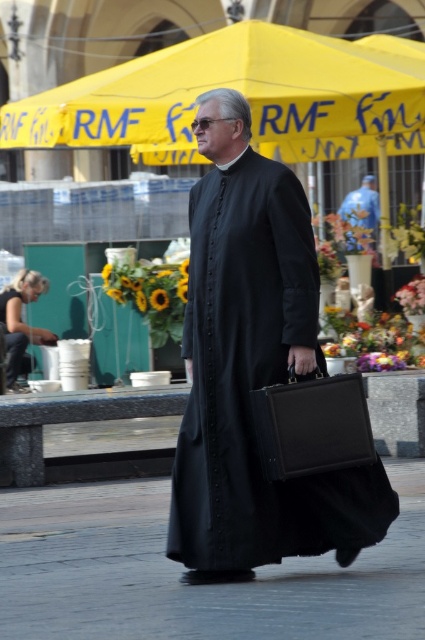
Question: Is black matte robe at center smaller than matte black nun at lower left?

Choices:
 (A) yes
 (B) no

Answer: (B)

Question: Does black matte robe at center come behind matte black nun at lower left?

Choices:
 (A) yes
 (B) no

Answer: (B)

Question: Can you confirm if black matte robe at center is positioned below blue fabric at center?

Choices:
 (A) yes
 (B) no

Answer: (A)

Question: Among these points, which one is nearest to the camera?

Choices:
 (A) click(x=292, y=216)
 (B) click(x=13, y=321)

Answer: (A)

Question: Which point is farther from the camera taking this photo?

Choices:
 (A) (370, 189)
 (B) (221, 488)
 (C) (331, 61)

Answer: (A)

Question: Which point appears closest to the camera in this image?

Choices:
 (A) (2, 317)
 (B) (11, 308)

Answer: (B)